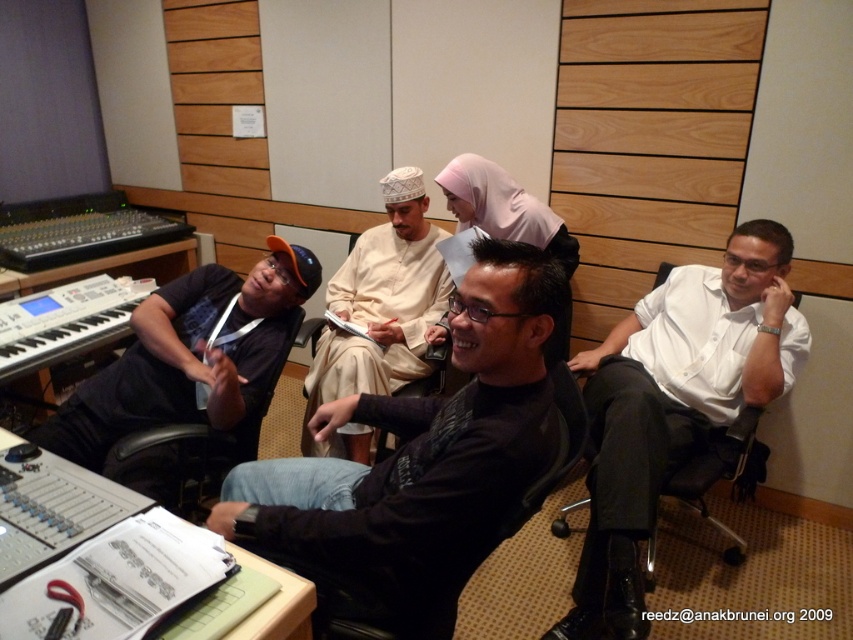
Question: Can you confirm if white shirt at right is positioned above black fabric shirt at left?

Choices:
 (A) yes
 (B) no

Answer: (B)

Question: Estimate the real-world distances between objects in this image. Which object is farther from the black matte shirt at center?

Choices:
 (A) white shirt at right
 (B) black leather chair at left

Answer: (A)

Question: Based on their relative distances, which object is nearer to the white shirt at right?

Choices:
 (A) black matte shirt at center
 (B) beige cotton shirt at center
 (C) black leather chair at left

Answer: (A)

Question: Which object is farther from the camera taking this photo?

Choices:
 (A) brown textured chair at center
 (B) beige cotton shirt at center
 (C) black leather chair at left

Answer: (B)

Question: Is black fabric shirt at left behind black leather chair at left?

Choices:
 (A) yes
 (B) no

Answer: (B)

Question: Can you confirm if white shirt at right is positioned to the left of black leather chair at left?

Choices:
 (A) yes
 (B) no

Answer: (B)